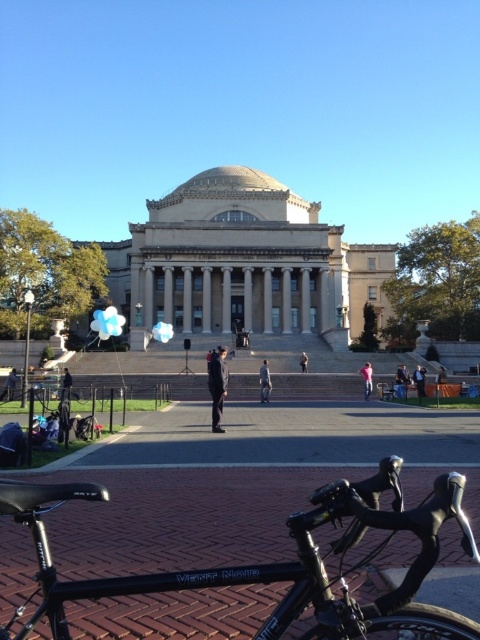
Is point (214, 378) positioned in front of point (10, 380)?

Yes.

Is dark blue fabric jacket at center bigger than dark blue jacket at lower left?

Indeed, dark blue fabric jacket at center has a larger size compared to dark blue jacket at lower left.

Who is more forward, (210, 380) or (13, 369)?

Point (210, 380) is more forward.

Find the location of a particular element. Image resolution: width=480 pixels, height=640 pixels. dark blue fabric jacket at center is located at coordinates (217, 385).

Does point (416, 380) lie in front of point (64, 369)?

Yes, point (416, 380) is closer to viewer.

Can you confirm if dark blue suit at center is thinner than black fabric jacket at lower left?

Yes.

Between point (417, 394) and point (61, 396), which one is positioned behind?

Positioned behind is point (417, 394).

The image size is (480, 640). I want to click on dark blue suit at center, so click(420, 380).

Can you confirm if dark blue jacket at lower left is positioned to the right of black fabric jacket at lower left?

→ No, dark blue jacket at lower left is not to the right of black fabric jacket at lower left.

Does dark blue jacket at lower left appear on the left side of black fabric jacket at lower left?

Correct, you'll find dark blue jacket at lower left to the left of black fabric jacket at lower left.

Who is more distant from viewer, (15,371) or (66,378)?

Positioned behind is point (15,371).

You are a GUI agent. You are given a task and a screenshot of the screen. Output one action in this format:
    pyautogui.click(x=<x>, y=<y>)
    Task: Click on the dark blue jacket at lower left
    The height and width of the screenshot is (640, 480).
    Given the screenshot: What is the action you would take?
    pyautogui.click(x=10, y=385)